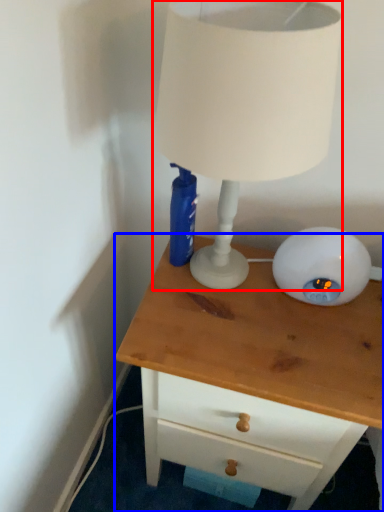
Question: Which object is further to the camera taking this photo, lamp (highlighted by a red box) or chest of drawers (highlighted by a blue box)?

Choices:
 (A) lamp
 (B) chest of drawers

Answer: (B)